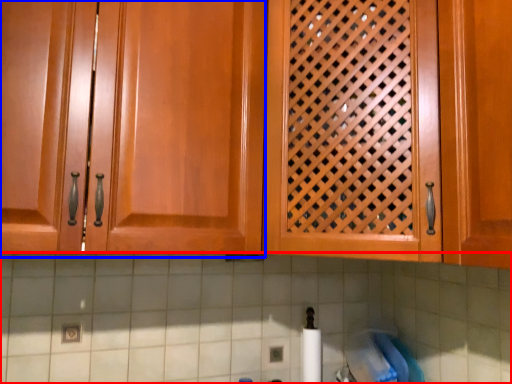
Question: Among these objects, which one is nearest to the camera, granite (highlighted by a red box) or cabinetry (highlighted by a blue box)?

Choices:
 (A) granite
 (B) cabinetry

Answer: (B)